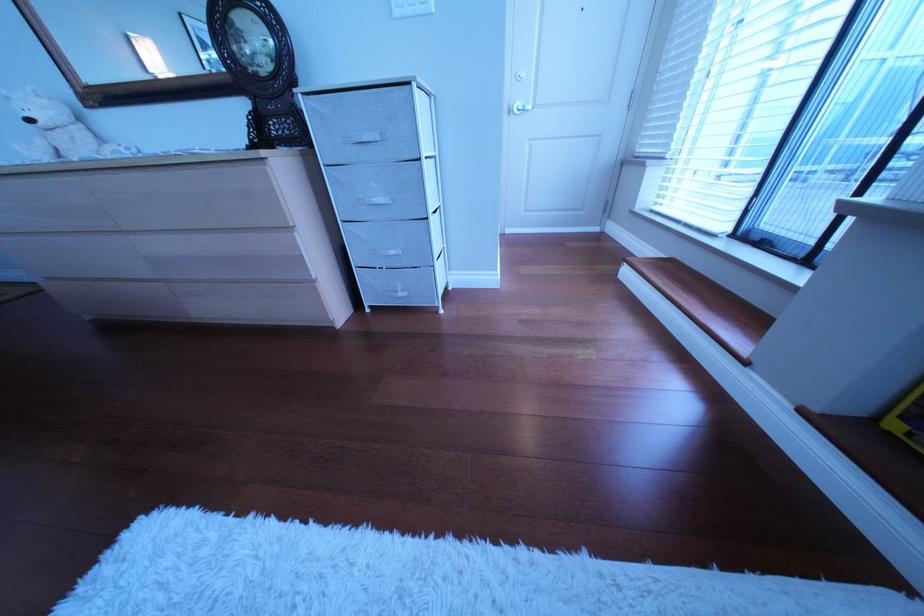
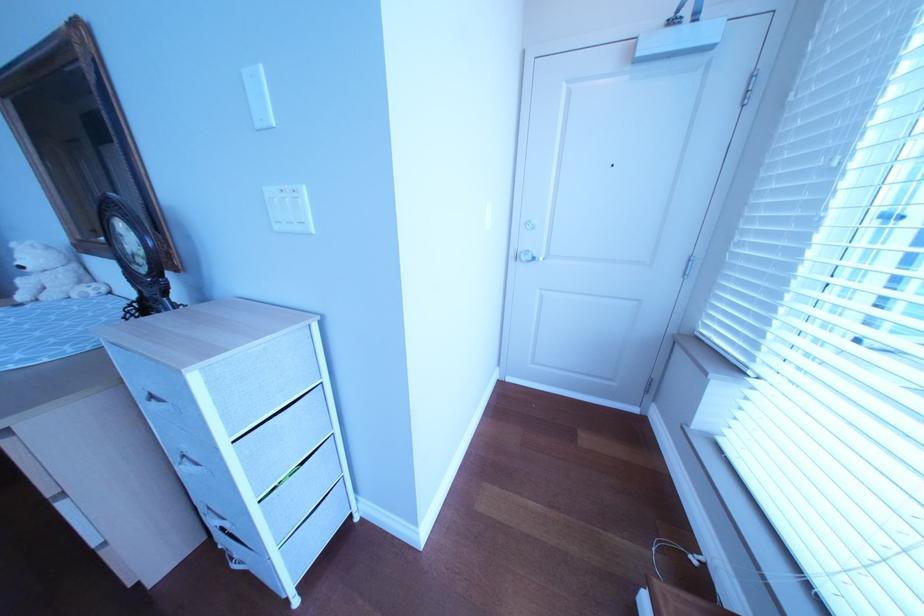
Where in the second image is the point corresponding to point (46, 122) from the first image?

(37, 270)